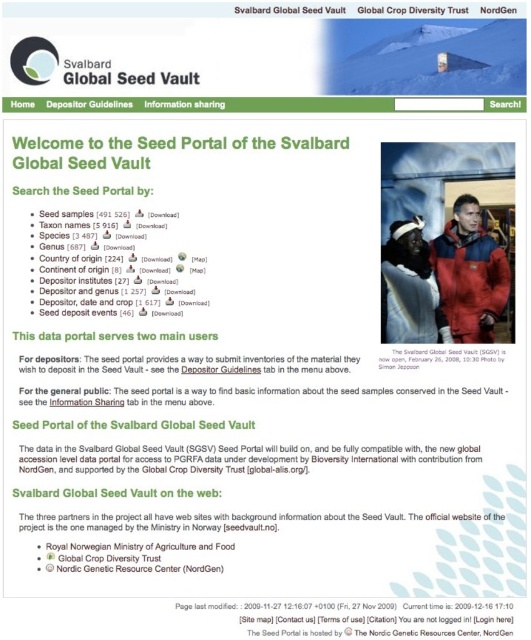
You are navigating the Svalbard Global Seed Vault website and see two points on the screen. The first point is located at coordinates point (x=482, y=260) and the second is at point (x=418, y=244). Which point appears closer to the top edge of the screen?

Point (x=482, y=260) is further to the camera than point (x=418, y=244), so the point closer to the top edge of the screen is point (x=418, y=244).

You are a researcher examining the Svalbard Global Seed Vault webpage. You notice two points on the page at coordinates point (492, 333) and point (389, 364). Which point is closer to the top of the page?

Point (492, 333) is closer to the top of the page because it has a lower y coordinate than point (389, 364).